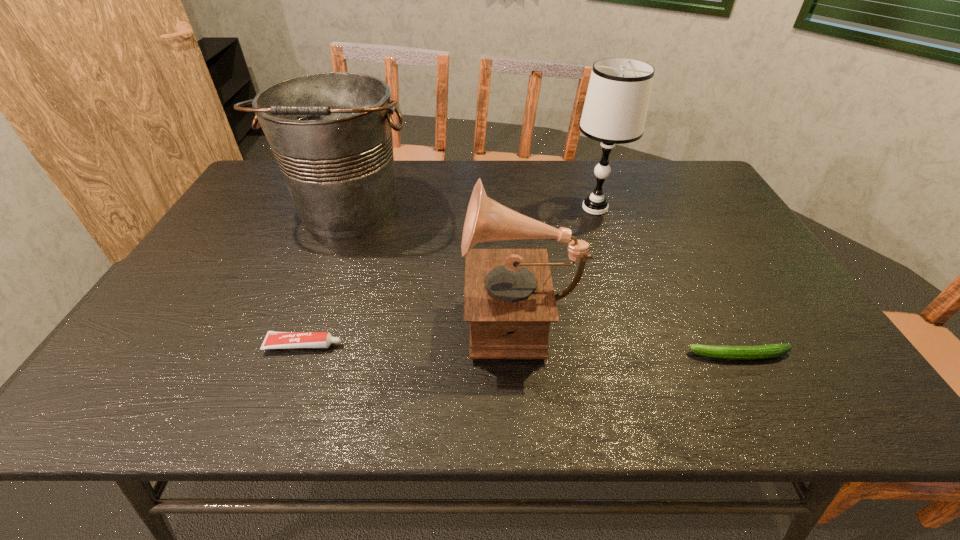
You are a GUI agent. You are given a task and a screenshot of the screen. Output one action in this format:
    pyautogui.click(x=<x>, y=<y>)
    Task: Click on the vacant space located at the nozzle of the toothpaste
    Image resolution: width=960 pixels, height=540 pixels.
    Given the screenshot: What is the action you would take?
    pyautogui.click(x=483, y=345)

Locate an element on the screen. vacant position located on the front-facing side of the zucchini is located at coordinates (656, 355).

Image resolution: width=960 pixels, height=540 pixels. In order to click on free space located on the front-facing side of the zucchini in this screenshot , I will do `click(536, 355)`.

Where is `vacant space located on the front-facing side of the zucchini`? The height and width of the screenshot is (540, 960). vacant space located on the front-facing side of the zucchini is located at coordinates (587, 355).

Find the location of a particular element. The image size is (960, 540). table lamp that is at the far edge is located at coordinates (615, 109).

This screenshot has height=540, width=960. In order to click on bucket that is at the far edge in this screenshot , I will do `click(331, 133)`.

Image resolution: width=960 pixels, height=540 pixels. I want to click on object that is at the right edge, so click(771, 350).

This screenshot has width=960, height=540. I want to click on vacant space at the far edge, so click(564, 193).

In the image, there is a desktop. At what (x,y) coordinates should I click in order to perform the action: click on free space at the near edge. Please return your answer as a coordinate pair (x, y). The width and height of the screenshot is (960, 540). Looking at the image, I should click on (356, 415).

Image resolution: width=960 pixels, height=540 pixels. What are the coordinates of `vacant area at the left edge` in the screenshot? It's located at (173, 288).